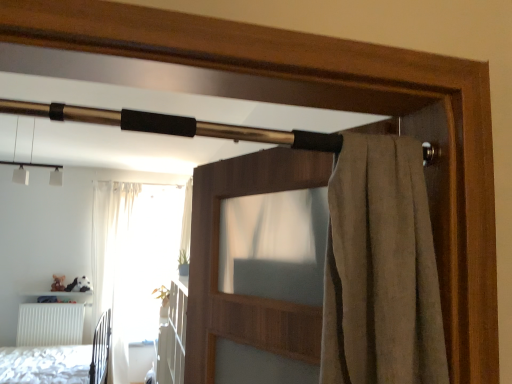
Question: Is white matte radiator at lower left at the left side of white textured bed at lower left?

Choices:
 (A) no
 (B) yes

Answer: (B)

Question: Is white matte radiator at lower left thinner than white textured bed at lower left?

Choices:
 (A) no
 (B) yes

Answer: (B)

Question: From a real-world perspective, is white matte radiator at lower left located higher than white textured bed at lower left?

Choices:
 (A) no
 (B) yes

Answer: (B)

Question: Is white matte radiator at lower left next to white textured bed at lower left?

Choices:
 (A) yes
 (B) no

Answer: (B)

Question: From a real-world perspective, is white matte radiator at lower left physically below white textured bed at lower left?

Choices:
 (A) yes
 (B) no

Answer: (B)

Question: Would you say white textured bed at lower left is part of white matte radiator at lower left's contents?

Choices:
 (A) yes
 (B) no

Answer: (B)

Question: From a real-world perspective, does white textured bed at lower left sit lower than white matte radiator at lower left?

Choices:
 (A) yes
 (B) no

Answer: (A)

Question: Is white textured bed at lower left touching white matte radiator at lower left?

Choices:
 (A) yes
 (B) no

Answer: (B)

Question: From a real-world perspective, is white textured bed at lower left positioned over white matte radiator at lower left based on gravity?

Choices:
 (A) yes
 (B) no

Answer: (B)

Question: Is white textured bed at lower left bigger than white matte radiator at lower left?

Choices:
 (A) yes
 (B) no

Answer: (A)

Question: Is white textured bed at lower left aimed at white matte radiator at lower left?

Choices:
 (A) no
 (B) yes

Answer: (A)

Question: From the image's perspective, is white textured bed at lower left beneath white matte radiator at lower left?

Choices:
 (A) no
 (B) yes

Answer: (A)

Question: Is white textured bed at lower left not inside brown fabric screen door at upper center?

Choices:
 (A) no
 (B) yes

Answer: (B)